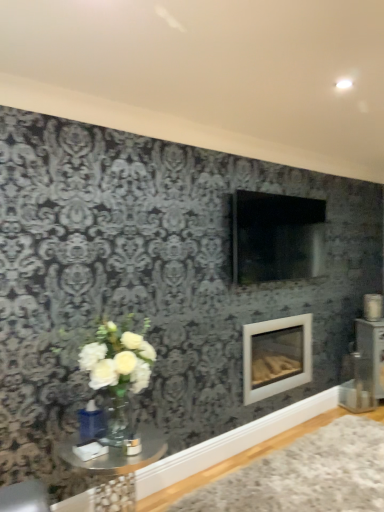
Question: In terms of height, does clear glass table at lower left look taller or shorter compared to white glossy fireplace at center?

Choices:
 (A) short
 (B) tall

Answer: (A)

Question: From the image's perspective, is clear glass table at lower left positioned above or below white glossy fireplace at center?

Choices:
 (A) below
 (B) above

Answer: (A)

Question: Considering the real-world distances, which object is farthest from the clear glass table at lower left?

Choices:
 (A) white glossy fireplace at center
 (B) white plush rug at lower right

Answer: (A)

Question: Which of these objects is positioned farthest from the white plush rug at lower right?

Choices:
 (A) clear glass table at lower left
 (B) white glossy fireplace at center

Answer: (A)